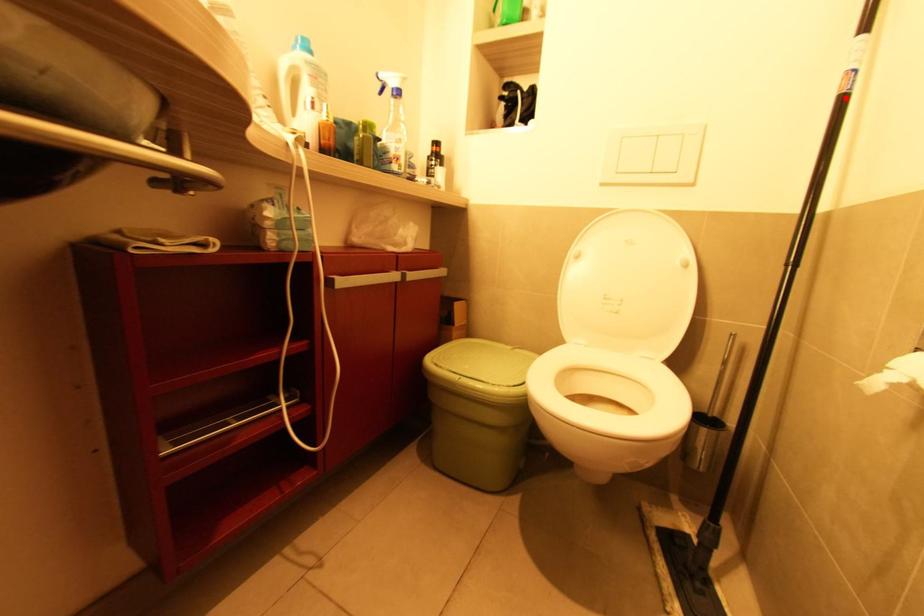
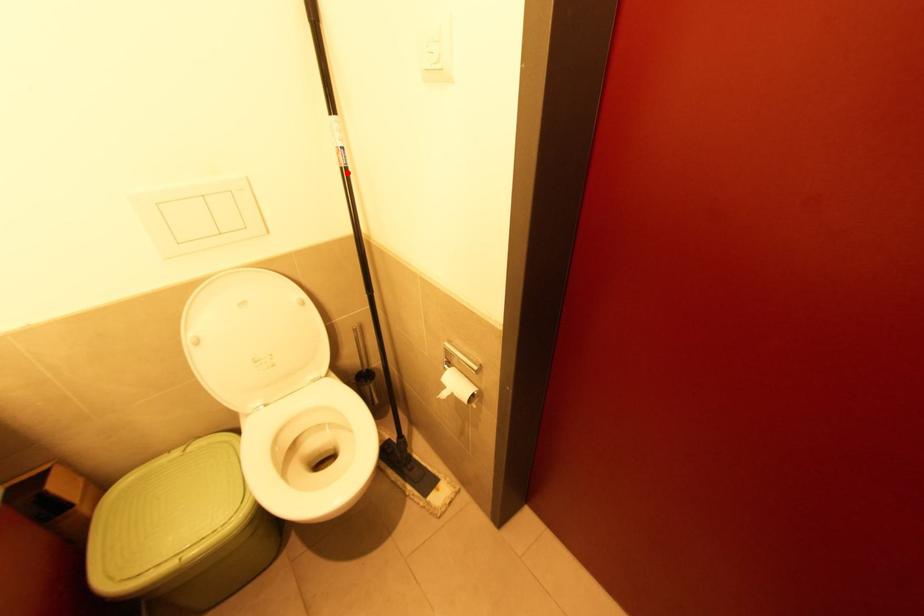
I am providing you with two images of the same scene from different viewpoints. A red point is marked on the first image and another point is marked on the second image. Does the point marked in image1 correspond to the same location as the one in image2?

Yes